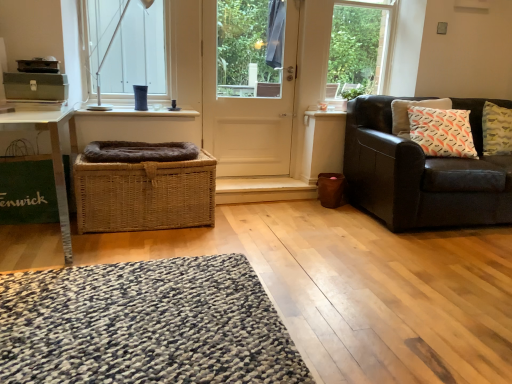
Question: Does white wood window frame at upper center have a greater height compared to white glossy window sill at upper center?

Choices:
 (A) yes
 (B) no

Answer: (A)

Question: From the image's perspective, does white wood window frame at upper center appear lower than white glossy window sill at upper center?

Choices:
 (A) no
 (B) yes

Answer: (A)

Question: Does white wood window frame at upper center have a larger size compared to white glossy window sill at upper center?

Choices:
 (A) yes
 (B) no

Answer: (A)

Question: Is white wood window frame at upper center oriented towards white glossy window sill at upper center?

Choices:
 (A) no
 (B) yes

Answer: (A)

Question: Considering the relative sizes of white wood window frame at upper center and white glossy window sill at upper center in the image provided, is white wood window frame at upper center thinner than white glossy window sill at upper center?

Choices:
 (A) no
 (B) yes

Answer: (B)

Question: Does white wood window frame at upper center have a greater width compared to white glossy window sill at upper center?

Choices:
 (A) no
 (B) yes

Answer: (A)

Question: Is dark brown leather couch at right thinner than white glossy window sill at upper center?

Choices:
 (A) yes
 (B) no

Answer: (B)

Question: Is the surface of dark brown leather couch at right in direct contact with white glossy window sill at upper center?

Choices:
 (A) yes
 (B) no

Answer: (B)

Question: Is dark brown leather couch at right oriented towards white glossy window sill at upper center?

Choices:
 (A) no
 (B) yes

Answer: (A)

Question: From the image's perspective, is dark brown leather couch at right on white glossy window sill at upper center?

Choices:
 (A) yes
 (B) no

Answer: (B)

Question: Considering the relative positions of dark brown leather couch at right and white glossy window sill at upper center in the image provided, is dark brown leather couch at right to the left of white glossy window sill at upper center from the viewer's perspective?

Choices:
 (A) yes
 (B) no

Answer: (B)

Question: Considering the relative sizes of dark brown leather couch at right and white glossy window sill at upper center in the image provided, is dark brown leather couch at right smaller than white glossy window sill at upper center?

Choices:
 (A) no
 (B) yes

Answer: (A)

Question: Does white matte door at center have a lesser width compared to dark brown leather couch at right?

Choices:
 (A) yes
 (B) no

Answer: (A)